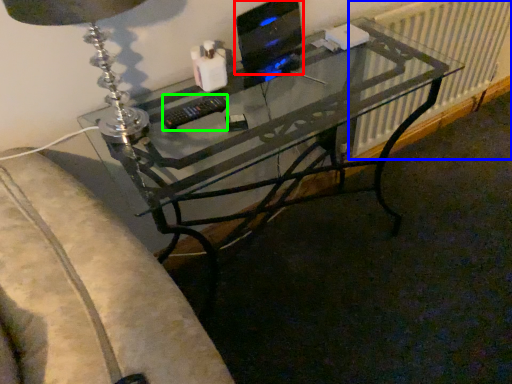
Question: Which object is positioned farthest from computer monitor (highlighted by a red box)? Select from radiator (highlighted by a blue box) and control (highlighted by a green box).

Choices:
 (A) radiator
 (B) control

Answer: (A)